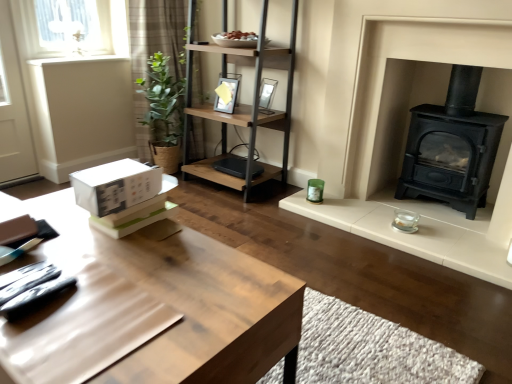
Question: From the image's perspective, is woodenmaterial/textureshelf at center located above or below white matte cardboard box at lower left?

Choices:
 (A) below
 (B) above

Answer: (B)

Question: Is woodenmaterial/textureshelf at center spatially inside white matte cardboard box at lower left, or outside of it?

Choices:
 (A) outside
 (B) inside

Answer: (A)

Question: Which is nearer to the woodenmaterial/textureshelf at center?

Choices:
 (A) matte glass picture frame at upper center, placed as the 2th picture frame when sorted from left to right
 (B) brown plaid curtain at upper left
 (C) matte black picture frame at upper center, the second picture frame when ordered from right to left
 (D) black cast iron wood burning stove at right
 (E) white matte cardboard box at lower left

Answer: (C)

Question: Which is farther from the light brown wooden table at center?

Choices:
 (A) white matte cardboard box at lower left
 (B) brown plaid curtain at upper left
 (C) matte black picture frame at upper center, the first picture frame viewed from the left
 (D) black cast iron wood burning stove at right
 (E) woodenmaterial/textureshelf at center

Answer: (B)